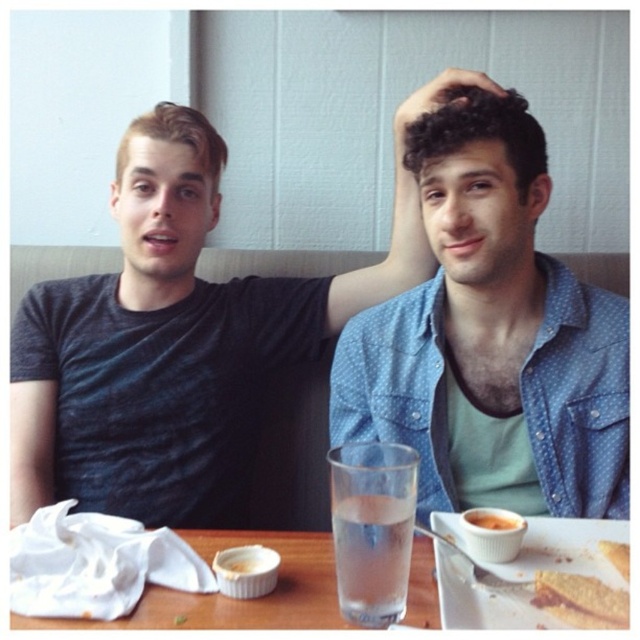
Question: Which of the following is the farthest from the observer?

Choices:
 (A) smooth orange cake at lower right
 (B) dark blue t-shirt at upper left
 (C) golden crumbly cake slice at lower right
 (D) clear glass water at center

Answer: (B)

Question: Is blue dotted shirt at upper right above white cloth at lower left?

Choices:
 (A) yes
 (B) no

Answer: (A)

Question: Which of the following is the farthest from the observer?

Choices:
 (A) clear glass water at center
 (B) golden crumbly cake slice at lower right
 (C) dark blue t-shirt at upper left
 (D) blue dotted shirt at upper right

Answer: (C)

Question: Can you confirm if dark blue t-shirt at upper left is wider than clear glass water at center?

Choices:
 (A) no
 (B) yes

Answer: (B)

Question: Does blue dotted shirt at upper right lie behind dark blue t-shirt at upper left?

Choices:
 (A) yes
 (B) no

Answer: (B)

Question: Which point is farther from the camera taking this photo?

Choices:
 (A) (396, 301)
 (B) (216, 616)

Answer: (A)